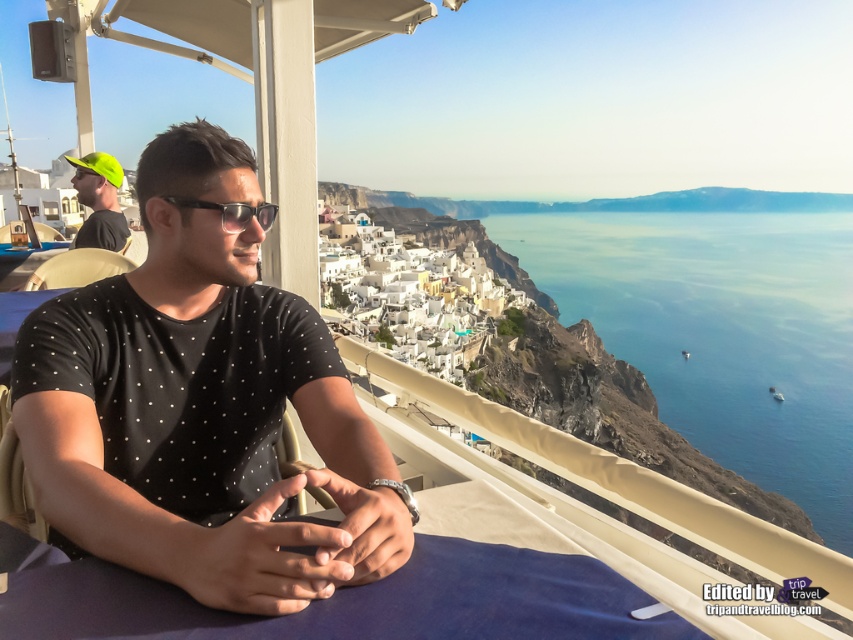
Is neon yellow cap at upper left positioned before black plastic sunglasses at center?

No.

Which is behind, point (84, 221) or point (222, 216)?

Point (84, 221)

Locate an element on the screen. The width and height of the screenshot is (853, 640). neon yellow cap at upper left is located at coordinates (99, 202).

Between point (132, 468) and point (90, 218), which one is positioned in front?

Point (132, 468)

Between point (216, 248) and point (71, 157), which one is positioned in front?

Positioned in front is point (216, 248).

Where is `black dotted shirt at center`? The height and width of the screenshot is (640, 853). black dotted shirt at center is located at coordinates (200, 406).

Which is more to the right, black dotted shirt at center or black plastic sunglasses at center?

Positioned to the right is black plastic sunglasses at center.

Is black dotted shirt at center to the left of black plastic sunglasses at center from the viewer's perspective?

Indeed, black dotted shirt at center is positioned on the left side of black plastic sunglasses at center.

You are a GUI agent. You are given a task and a screenshot of the screen. Output one action in this format:
    pyautogui.click(x=<x>, y=<y>)
    Task: Click on the black dotted shirt at center
    
    Given the screenshot: What is the action you would take?
    pyautogui.click(x=200, y=406)

Where is `black dotted shirt at center`? black dotted shirt at center is located at coordinates (200, 406).